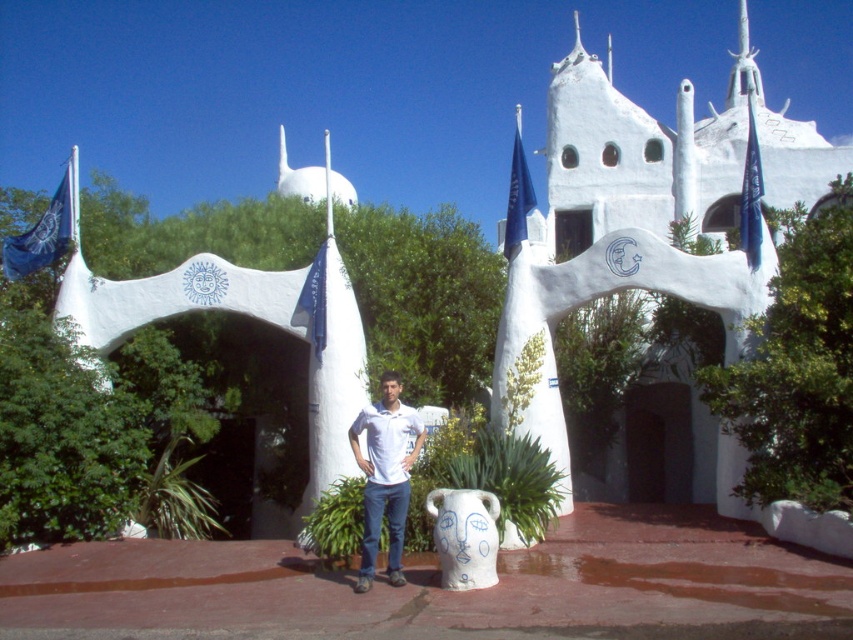
Question: Among these points, which one is nearest to the camera?

Choices:
 (A) (309, 324)
 (B) (71, 157)
 (C) (567, 118)
 (D) (358, 584)

Answer: (D)

Question: Which point is closer to the camera?

Choices:
 (A) white matte arch at center
 (B) blue fabric flag at center

Answer: (A)

Question: Which point is farther to the camera?

Choices:
 (A) white matte arch at center
 (B) blue fabric flag at upper left
 (C) white stucco church at center

Answer: (B)

Question: Does blue fabric flag at upper left have a greater width compared to blue fabric flag at center?

Choices:
 (A) no
 (B) yes

Answer: (B)

Question: Is blue fabric flag at upper right positioned before blue fabric flag at center?

Choices:
 (A) yes
 (B) no

Answer: (A)

Question: Observing the image, what is the correct spatial positioning of blue fabric flag at upper left in reference to blue fabric flag at upper right?

Choices:
 (A) above
 (B) below

Answer: (A)